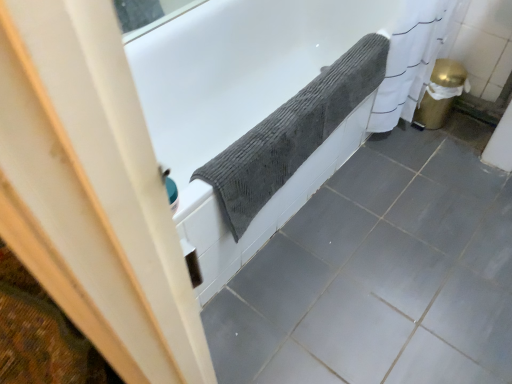
Question: Are gray matte ceramic tile at lower center, positioned as the 1th ceramic tile in top-to-bottom order, and textured gray towel at upper center, the 1th ceramic tile ordered from the bottom, located far from each other?

Choices:
 (A) no
 (B) yes

Answer: (A)

Question: Can you confirm if gray matte ceramic tile at lower center, which is the 2th ceramic tile in bottom-to-top order, is wider than textured gray towel at upper center, the 1th ceramic tile ordered from the bottom?

Choices:
 (A) no
 (B) yes

Answer: (A)

Question: Considering the relative sizes of gray matte ceramic tile at lower center, which is the 2th ceramic tile in bottom-to-top order, and textured gray towel at upper center, positioned as the second ceramic tile in top-to-bottom order, in the image provided, is gray matte ceramic tile at lower center, which is the 2th ceramic tile in bottom-to-top order, thinner than textured gray towel at upper center, positioned as the second ceramic tile in top-to-bottom order,?

Choices:
 (A) no
 (B) yes

Answer: (B)

Question: Is gray matte ceramic tile at lower center, positioned as the 1th ceramic tile in top-to-bottom order, surrounding textured gray towel at upper center, positioned as the second ceramic tile in top-to-bottom order?

Choices:
 (A) no
 (B) yes

Answer: (A)

Question: Is gray matte ceramic tile at lower center, which is the 2th ceramic tile in bottom-to-top order, closer to the viewer compared to textured gray towel at upper center, the 1th ceramic tile ordered from the bottom?

Choices:
 (A) yes
 (B) no

Answer: (B)

Question: From the image's perspective, relative to gray matte ceramic tile at lower center, which is the 2th ceramic tile in bottom-to-top order, is gray textured towel at upper center above or below?

Choices:
 (A) below
 (B) above

Answer: (B)

Question: Is gray textured towel at upper center taller or shorter than gray matte ceramic tile at lower center, positioned as the 1th ceramic tile in top-to-bottom order?

Choices:
 (A) tall
 (B) short

Answer: (A)

Question: Looking at their shapes, would you say gray textured towel at upper center is wider or thinner than gray matte ceramic tile at lower center, positioned as the 1th ceramic tile in top-to-bottom order?

Choices:
 (A) thin
 (B) wide

Answer: (B)

Question: Based on their positions, is gray textured towel at upper center located to the left or right of gray matte ceramic tile at lower center, positioned as the 1th ceramic tile in top-to-bottom order?

Choices:
 (A) right
 (B) left

Answer: (B)

Question: Would you say textured gray towel at upper center, positioned as the second ceramic tile in top-to-bottom order, is to the left or to the right of gray textured towel at upper center in the picture?

Choices:
 (A) right
 (B) left

Answer: (A)

Question: Is textured gray towel at upper center, the 1th ceramic tile ordered from the bottom, taller or shorter than gray textured towel at upper center?

Choices:
 (A) short
 (B) tall

Answer: (A)

Question: Considering their positions, is textured gray towel at upper center, positioned as the second ceramic tile in top-to-bottom order, located in front of or behind gray textured towel at upper center?

Choices:
 (A) behind
 (B) front

Answer: (B)

Question: Is textured gray towel at upper center, positioned as the second ceramic tile in top-to-bottom order, wider or thinner than gray textured towel at upper center?

Choices:
 (A) wide
 (B) thin

Answer: (A)

Question: Looking at the image, does textured gray towel at upper center, positioned as the second ceramic tile in top-to-bottom order, seem bigger or smaller compared to gray textured towel at upper center?

Choices:
 (A) small
 (B) big

Answer: (A)

Question: In terms of width, does textured gray towel at upper center, the 1th ceramic tile ordered from the bottom, look wider or thinner when compared to gray textured towel at upper center?

Choices:
 (A) wide
 (B) thin

Answer: (A)